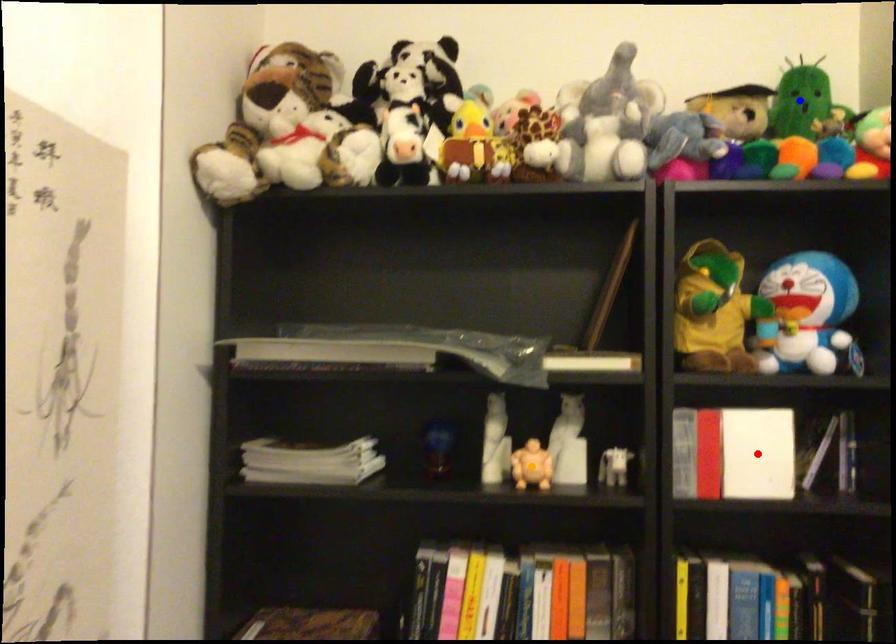
Order these from nearest to farthest:
A) blue point
B) red point
C) orange point

red point < orange point < blue point